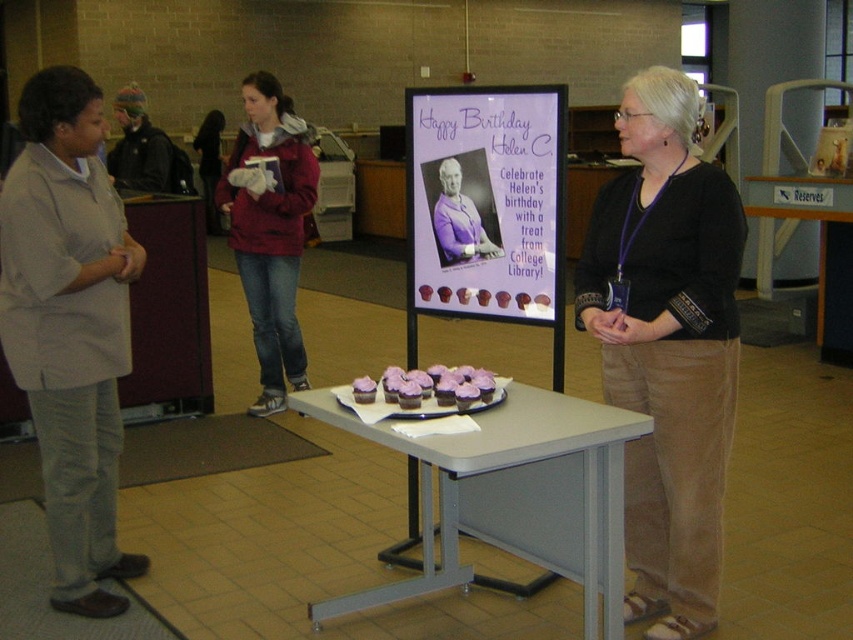
Can you confirm if matte red jacket at center is shorter than knitted wool hat at left?

No.

Does point (288, 352) come behind point (144, 186)?

No, it is not.

Who is more forward, (248,144) or (117,140)?

Point (248,144)

The width and height of the screenshot is (853, 640). In order to click on matte red jacket at center in this screenshot , I will do `click(270, 228)`.

Between black cotton shirt at center and matte red jacket at center, which one appears on the left side from the viewer's perspective?

Positioned to the left is matte red jacket at center.

Which is below, black cotton shirt at center or matte red jacket at center?

black cotton shirt at center

Image resolution: width=853 pixels, height=640 pixels. I want to click on black cotton shirt at center, so (x=666, y=346).

Is gray metal table at center thinner than knitted wool hat at left?

Incorrect, gray metal table at center's width is not less than knitted wool hat at left's.

Which is more to the left, gray metal table at center or knitted wool hat at left?

Positioned to the left is knitted wool hat at left.

Which is behind, point (604, 410) or point (131, 108)?

Positioned behind is point (131, 108).

Identify the location of gray metal table at center. point(511,496).